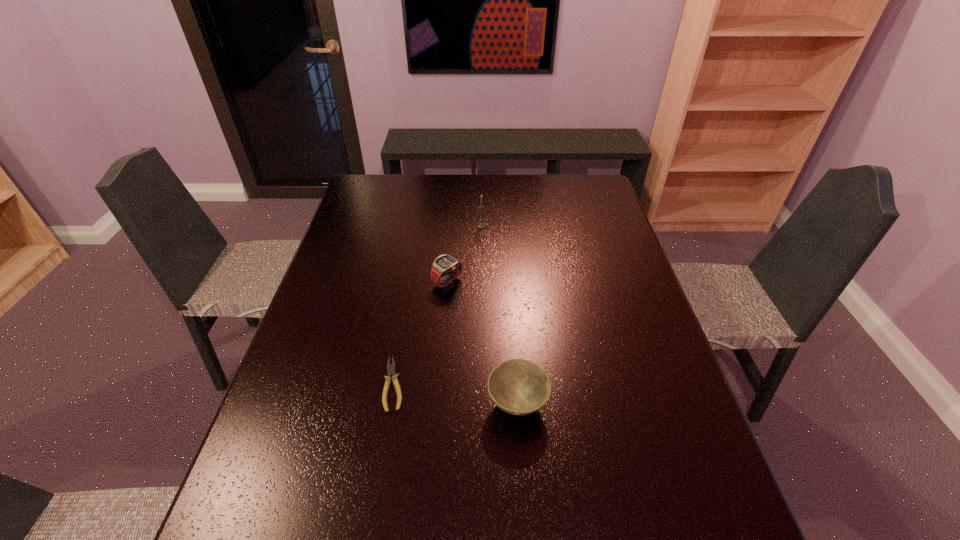
Locate an element on the screen. The image size is (960, 540). the tallest object is located at coordinates (481, 224).

Identify the location of candle. The width and height of the screenshot is (960, 540). (481, 224).

Locate an element on the screen. watch is located at coordinates (444, 265).

At what (x,y) coordinates should I click in order to perform the action: click on the third object from right to left. Please return your answer as a coordinate pair (x, y). The width and height of the screenshot is (960, 540). Looking at the image, I should click on (444, 265).

The image size is (960, 540). I want to click on bowl, so click(520, 387).

You are a GUI agent. You are given a task and a screenshot of the screen. Output one action in this format:
    pyautogui.click(x=<x>, y=<y>)
    Task: Click on the shortest object
    
    Given the screenshot: What is the action you would take?
    pyautogui.click(x=390, y=367)

The height and width of the screenshot is (540, 960). What are the coordinates of `the leftmost object` in the screenshot? It's located at (390, 367).

The width and height of the screenshot is (960, 540). Identify the location of vacant space situated 0.110m on the right of the farthest object. (519, 226).

This screenshot has height=540, width=960. In order to click on vacant space situated 0.300m on the left of the third object from right to left in this screenshot , I will do `click(331, 281)`.

At what (x,y) coordinates should I click in order to perform the action: click on free space located 0.210m on the back of the bowl. Please return your answer as a coordinate pair (x, y). The width and height of the screenshot is (960, 540). Looking at the image, I should click on (511, 314).